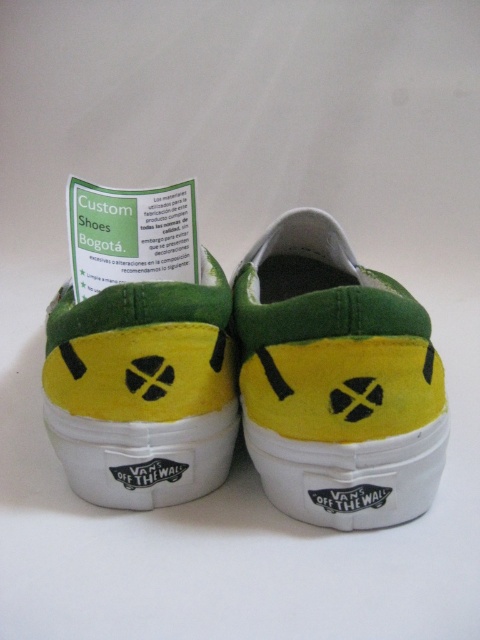
You are a customer at a shoe store in Bogot. You see a pair of custom Vans shoes displayed on a plain white background. The shoes are placed side by side with their soles facing forward. There is a small green card between them that says Custom Shoes Bogot. A point is marked at coordinates (336, 380). Which object is this point located on?

The point marked at coordinates (336, 380) is located on the green felt shoe at center.

From the picture: You are a customer at a shoe store and see the green felt shoe at center and the yellow suede shoe at center displayed side by side. Which shoe has a wider base?

The green felt shoe at center has a wider base than the yellow suede shoe at center.

You are a customer looking at the green felt shoe at center and the yellow suede shoe at center displayed on a plain white background. Which shoe has a taller height?

The green felt shoe at center has a greater height compared to the yellow suede shoe at center.